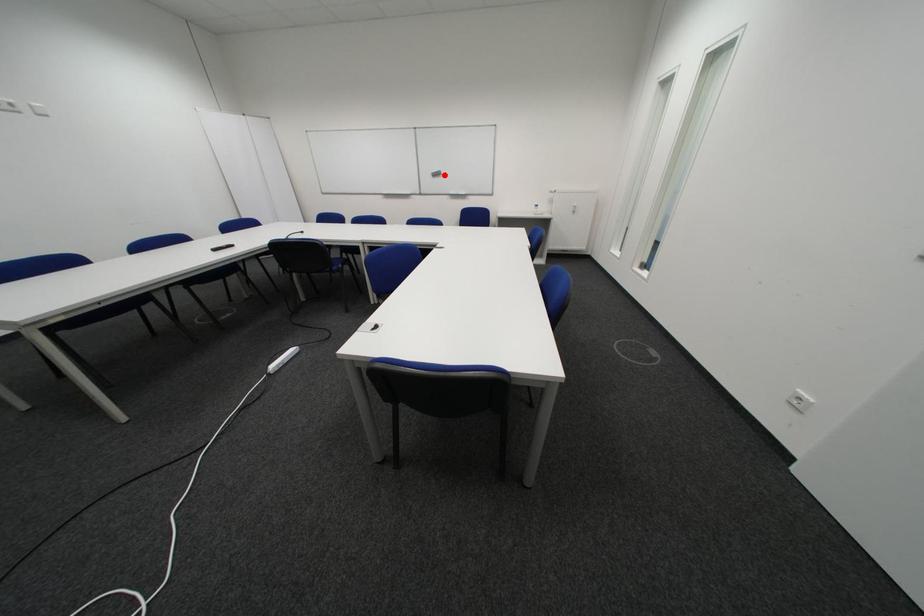
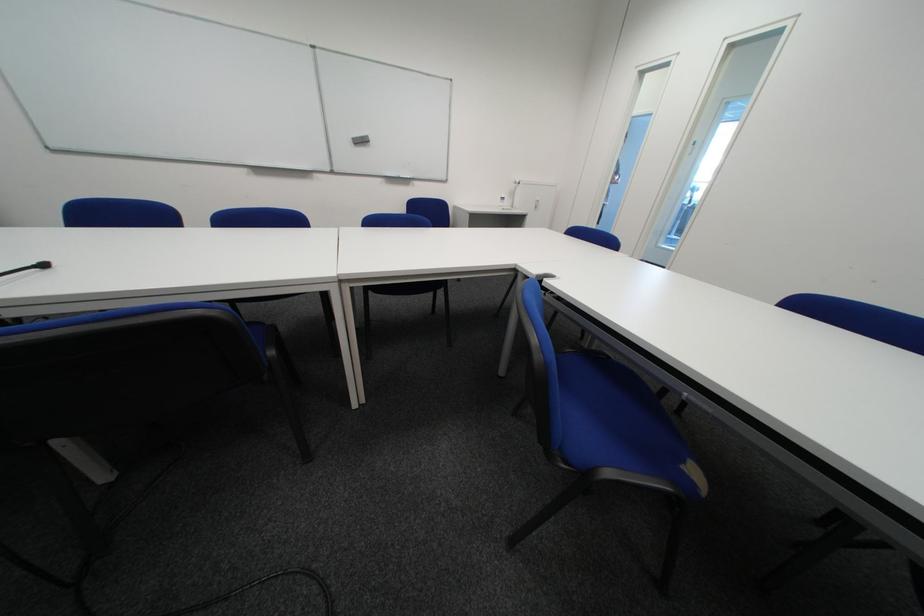
Find the pixel in the second image that matches the highlighted location in the first image.

(365, 140)